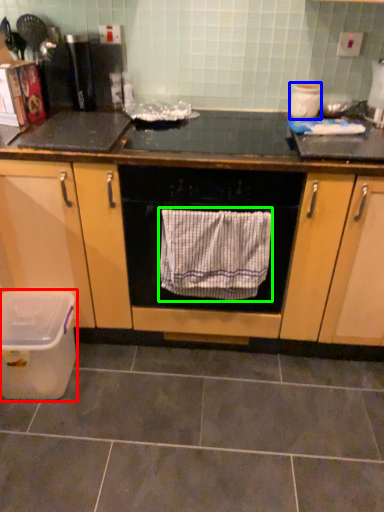
Question: Estimate the real-world distances between objects in this image. Which object is closer to kitchen appliance (highlighted by a red box), appliance (highlighted by a blue box) or bath towel (highlighted by a green box)?

Choices:
 (A) appliance
 (B) bath towel

Answer: (B)